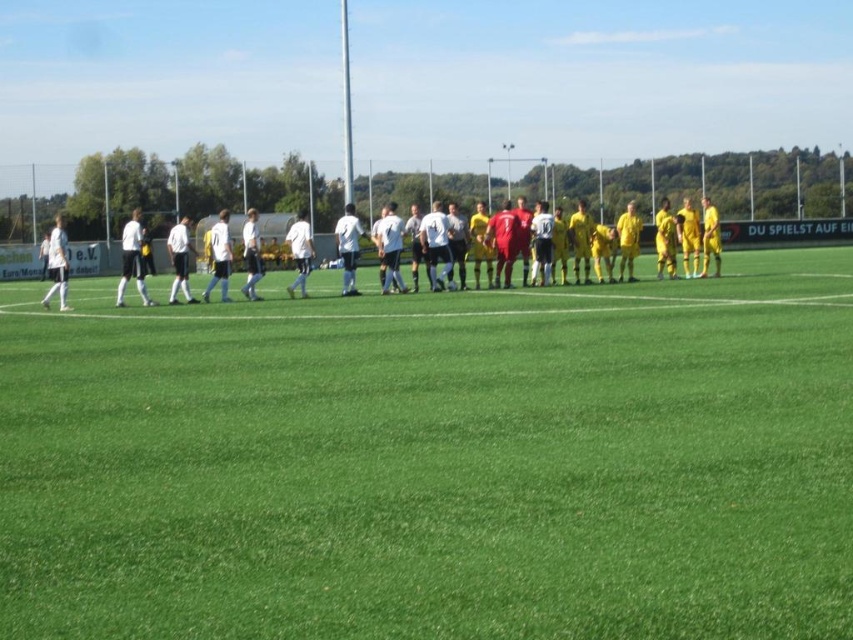
You are a photographer standing at the edge of the soccer field. You want to take a photo that includes both the green grass field at center and the white matte soccer team at center. Based on their positions, which object will appear closer to the camera in the photo?

The white matte soccer team at center appears closer to the camera because it is positioned over the green grass field at center.

You are standing at the point marked by the coordinates point (416,378) on the soccer field. A soccer ball is placed exactly where you are standing. If you want to kick the ball towards the fence in the background, which is located behind the wooded area, will the ball travel away from or towards the two teams lined up in the image?

The point (416,378) is 11.71 meters away from the viewer. Since the fence is behind the wooded area and the teams are lined up on the field, kicking the ball towards the fence would send it away from the teams towards the wooded area and fence.

You are a photographer positioned at the edge of the soccer field. You want to capture a photo where the green grass field at center is visible behind the white matte soccer team at center. Is this possible given their positions?

The green grass field at center is in front of the white matte soccer team at center, so it would block the view. Therefore, you cannot capture the green grass field at center behind the white matte soccer team at center as they are positioned with the field in front of the team.